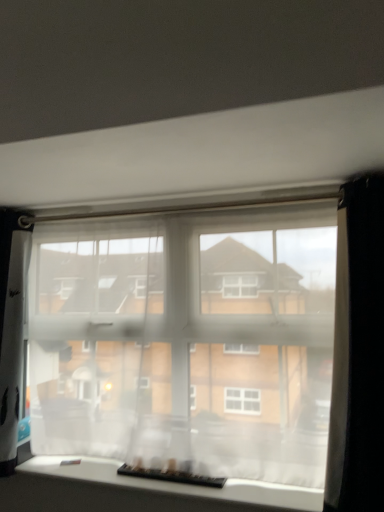
Question: Does translucent fabric at center, which appears as the 1th window when viewed from the top, have a greater height compared to translucent fabric at bottom, which is counted as the 1th window, starting from the bottom?

Choices:
 (A) yes
 (B) no

Answer: (A)

Question: Is translucent fabric at center, which appears as the 2th window when ordered from the bottom, oriented towards translucent fabric at bottom, marked as the 2th window in a top-to-bottom arrangement?

Choices:
 (A) yes
 (B) no

Answer: (B)

Question: Are translucent fabric at center, which appears as the 2th window when ordered from the bottom, and translucent fabric at bottom, marked as the 2th window in a top-to-bottom arrangement, making contact?

Choices:
 (A) no
 (B) yes

Answer: (A)

Question: Is translucent fabric at center, which appears as the 2th window when ordered from the bottom, to the left of translucent fabric at bottom, marked as the 2th window in a top-to-bottom arrangement, from the viewer's perspective?

Choices:
 (A) yes
 (B) no

Answer: (B)

Question: From a real-world perspective, is translucent fabric at center, which appears as the 1th window when viewed from the top, below translucent fabric at bottom, marked as the 2th window in a top-to-bottom arrangement?

Choices:
 (A) no
 (B) yes

Answer: (A)

Question: From the image's perspective, is translucent fabric at center, which appears as the 2th window when ordered from the bottom, located above or below translucent fabric at bottom, which is counted as the 1th window, starting from the bottom?

Choices:
 (A) below
 (B) above

Answer: (B)

Question: Considering the positions of point (216, 419) and point (86, 473), is point (216, 419) closer or farther from the camera than point (86, 473)?

Choices:
 (A) farther
 (B) closer

Answer: (B)

Question: Relative to translucent fabric at bottom, marked as the 2th window in a top-to-bottom arrangement, is translucent fabric at center, which appears as the 2th window when ordered from the bottom, in front or behind?

Choices:
 (A) front
 (B) behind

Answer: (B)

Question: Considering the relative positions of translucent fabric at center, which appears as the 1th window when viewed from the top, and translucent fabric at bottom, which is counted as the 1th window, starting from the bottom, in the image provided, is translucent fabric at center, which appears as the 1th window when viewed from the top, to the left or to the right of translucent fabric at bottom, which is counted as the 1th window, starting from the bottom,?

Choices:
 (A) left
 (B) right

Answer: (B)

Question: Is translucent fabric at center, which appears as the 2th window when ordered from the bottom, situated inside black sheer curtain at right or outside?

Choices:
 (A) outside
 (B) inside

Answer: (A)

Question: Does point (259, 402) appear closer or farther from the camera than point (359, 306)?

Choices:
 (A) farther
 (B) closer

Answer: (A)

Question: Is translucent fabric at center, which appears as the 1th window when viewed from the top, in front of or behind black sheer curtain at right in the image?

Choices:
 (A) behind
 (B) front

Answer: (A)

Question: Is translucent fabric at center, which appears as the 1th window when viewed from the top, to the left or to the right of black sheer curtain at right in the image?

Choices:
 (A) right
 (B) left

Answer: (B)

Question: Is translucent fabric at center, which appears as the 2th window when ordered from the bottom, wider or thinner than black plastic keyboard at lower center?

Choices:
 (A) thin
 (B) wide

Answer: (A)

Question: In terms of height, does translucent fabric at center, which appears as the 1th window when viewed from the top, look taller or shorter compared to black plastic keyboard at lower center?

Choices:
 (A) short
 (B) tall

Answer: (B)